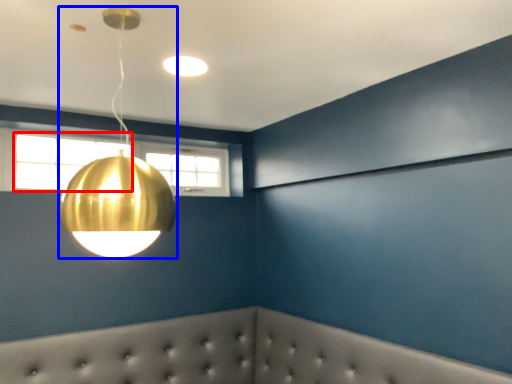
Question: Which object appears closest to the camera in this image, window (highlighted by a red box) or lamp (highlighted by a blue box)?

Choices:
 (A) window
 (B) lamp

Answer: (B)